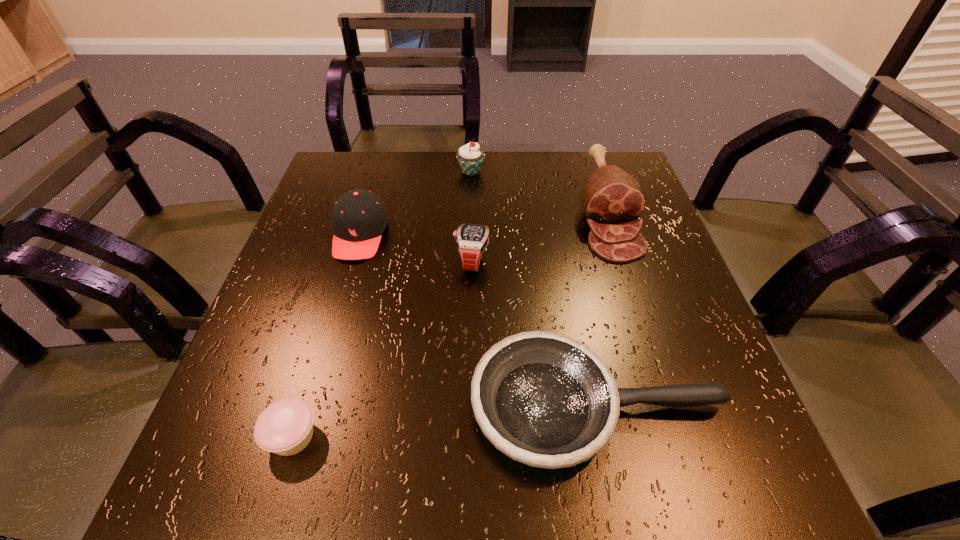
What are the coordinates of `ham` in the screenshot? It's located at (613, 201).

You are a GUI agent. You are given a task and a screenshot of the screen. Output one action in this format:
    pyautogui.click(x=<x>, y=<y>)
    Task: Click on the right cupcake
    This screenshot has width=960, height=540.
    Given the screenshot: What is the action you would take?
    pyautogui.click(x=470, y=158)

This screenshot has height=540, width=960. What are the coordinates of `the taller cupcake` in the screenshot? It's located at (470, 158).

The image size is (960, 540). Identify the location of cap. (359, 218).

Where is `watch`? watch is located at coordinates tap(472, 240).

Locate an element on the screen. This screenshot has height=540, width=960. frying pan is located at coordinates (544, 399).

Where is `the shorter cupcake`? the shorter cupcake is located at coordinates (285, 427).

I want to click on the nearer cupcake, so click(x=285, y=427).

You are a GUI agent. You are given a task and a screenshot of the screen. Output one action in this format:
    pyautogui.click(x=<x>, y=<y>)
    Task: Click on the vacant area situated 0.280m at the sliced end of the ham
    This screenshot has width=960, height=540.
    Given the screenshot: What is the action you would take?
    click(x=659, y=377)

This screenshot has width=960, height=540. I want to click on free point located on the right of the farther cupcake, so coord(574,172).